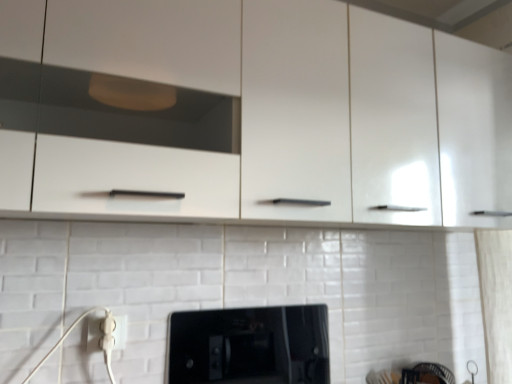
Question: From the image's perspective, is black glossy microwave at center on white plastic electric outlet at lower left?

Choices:
 (A) yes
 (B) no

Answer: (B)

Question: Is black glossy microwave at center facing away from white plastic electric outlet at lower left?

Choices:
 (A) no
 (B) yes

Answer: (A)

Question: Can you confirm if black glossy microwave at center is positioned to the right of white plastic electric outlet at lower left?

Choices:
 (A) yes
 (B) no

Answer: (A)

Question: Could you tell me if black glossy microwave at center is facing white plastic electric outlet at lower left?

Choices:
 (A) yes
 (B) no

Answer: (B)

Question: Considering the relative sizes of black glossy microwave at center and white plastic electric outlet at lower left in the image provided, is black glossy microwave at center shorter than white plastic electric outlet at lower left?

Choices:
 (A) yes
 (B) no

Answer: (B)

Question: Is black glossy microwave at center wider than white plastic electric outlet at lower left?

Choices:
 (A) yes
 (B) no

Answer: (A)

Question: From a real-world perspective, is white plastic electric outlet at lower left located beneath black glossy microwave at center?

Choices:
 (A) no
 (B) yes

Answer: (A)

Question: Is white plastic electric outlet at lower left at the right side of black glossy microwave at center?

Choices:
 (A) yes
 (B) no

Answer: (B)

Question: Considering the relative positions of white plastic electric outlet at lower left and black glossy microwave at center in the image provided, is white plastic electric outlet at lower left to the left of black glossy microwave at center from the viewer's perspective?

Choices:
 (A) yes
 (B) no

Answer: (A)

Question: Can you confirm if white plastic electric outlet at lower left is wider than black glossy microwave at center?

Choices:
 (A) yes
 (B) no

Answer: (B)

Question: Could you tell me if white plastic electric outlet at lower left is turned towards black glossy microwave at center?

Choices:
 (A) yes
 (B) no

Answer: (B)

Question: Is black glossy microwave at center located within white plastic electric outlet at lower left?

Choices:
 (A) yes
 (B) no

Answer: (B)

Question: From a real-world perspective, is white plastic electric outlet at lower left physically located above or below black glossy microwave at center?

Choices:
 (A) below
 (B) above

Answer: (B)